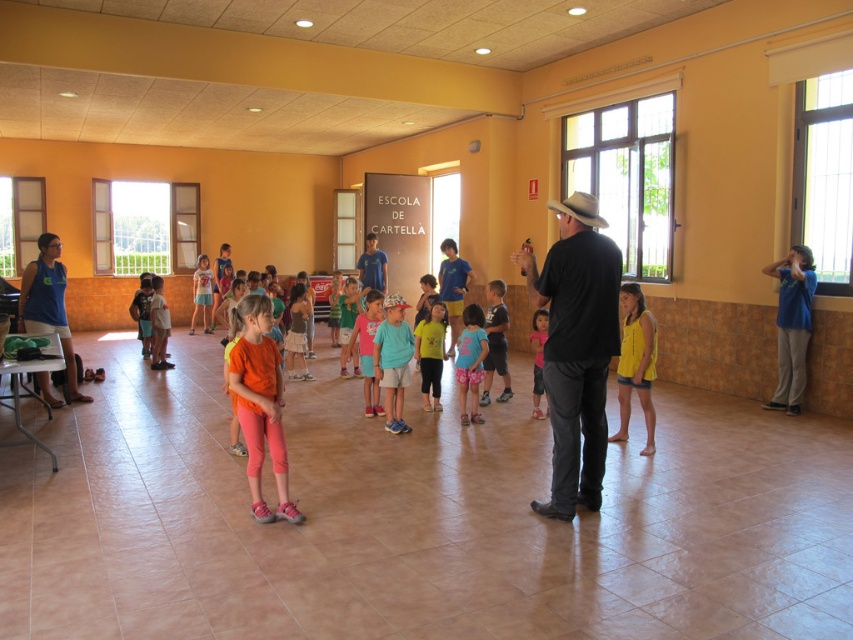
Question: Does black matte shirt at center have a smaller size compared to pink cotton shorts at center?

Choices:
 (A) no
 (B) yes

Answer: (A)

Question: Among these points, which one is farthest from the camera?

Choices:
 (A) (479, 372)
 (B) (590, 204)
 (C) (566, 285)
 (D) (648, 342)

Answer: (A)

Question: From the image, what is the correct spatial relationship of pink cotton shorts at center in relation to dark blue shirt at center?

Choices:
 (A) right
 (B) left

Answer: (B)

Question: Among these objects, which one is nearest to the camera?

Choices:
 (A) dark blue shirt at center
 (B) pink cotton shorts at center
 (C) matte yellow shirt at center

Answer: (B)

Question: Estimate the real-world distances between objects in this image. Which object is farther from the pink cotton shorts at center?

Choices:
 (A) brown felt cowboy hat at upper center
 (B) matte yellow shirt at center
 (C) matte orange shirt at center

Answer: (C)

Question: Does black matte shirt at center come in front of dark blue shirt at center?

Choices:
 (A) yes
 (B) no

Answer: (A)